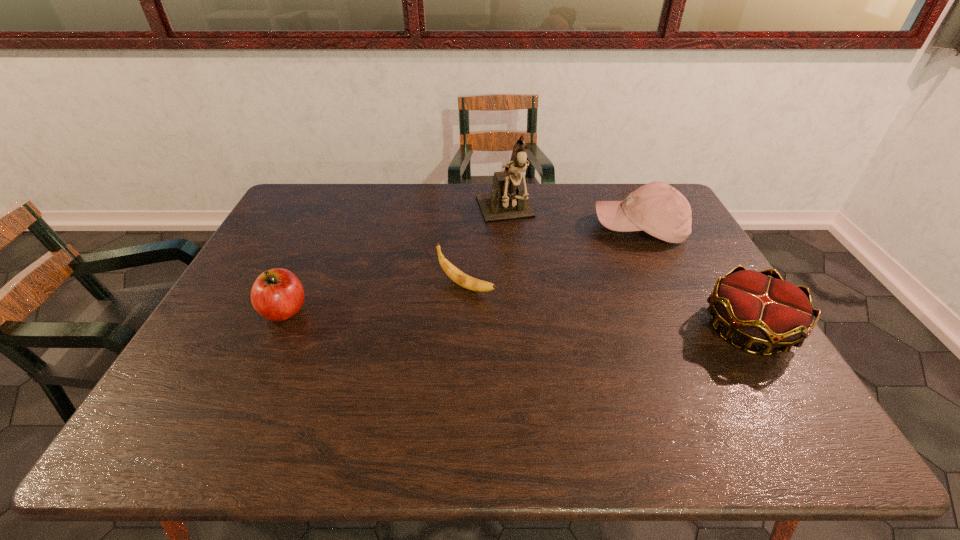
At what (x,y) coordinates should I click in order to perform the action: click on unoccupied position between the baseball cap and the banana. Please return your answer as a coordinate pair (x, y). This screenshot has height=540, width=960. Looking at the image, I should click on (553, 258).

Find the location of `free space between the banana and the leftmost object`. free space between the banana and the leftmost object is located at coordinates (375, 299).

The height and width of the screenshot is (540, 960). I want to click on vacant space in between the apple and the figurine, so click(395, 262).

The image size is (960, 540). Identify the location of vacant space that's between the crown and the figurine. coord(627,271).

Locate an element on the screen. This screenshot has height=540, width=960. vacant area between the fourth shortest object and the figurine is located at coordinates (572, 221).

The image size is (960, 540). In order to click on vacant area between the leftmost object and the tallest object in this screenshot , I will do `click(395, 262)`.

This screenshot has height=540, width=960. I want to click on unoccupied position between the tallest object and the apple, so click(x=395, y=262).

In order to click on the third closest object to the crown in this screenshot , I will do `click(459, 277)`.

This screenshot has width=960, height=540. I want to click on object that is the closest one to the figurine, so click(x=459, y=277).

This screenshot has width=960, height=540. I want to click on free spot that satisfies the following two spatial constraints: 1. on the back side of the banana; 2. on the left side of the figurine, so click(x=468, y=214).